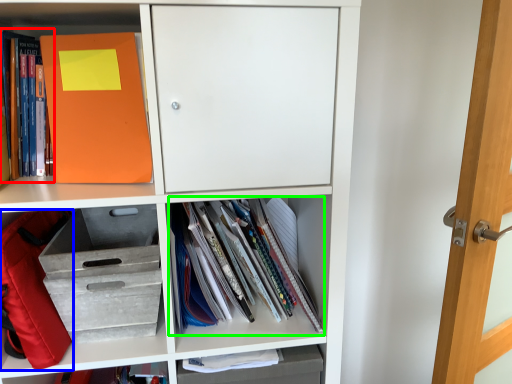
Question: Which is farther away from book (highlighted by a red box)? backpack (highlighted by a blue box) or book (highlighted by a green box)?

Choices:
 (A) backpack
 (B) book

Answer: (B)